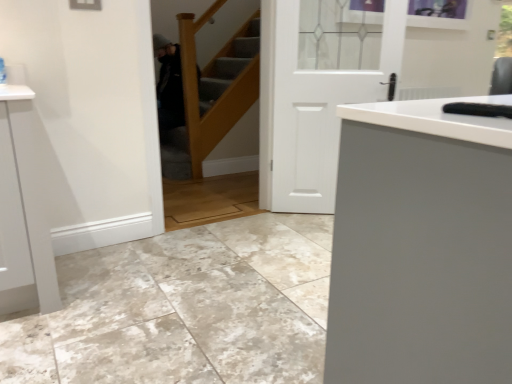
I want to click on free space in front of white wooden door at center, so click(x=303, y=237).